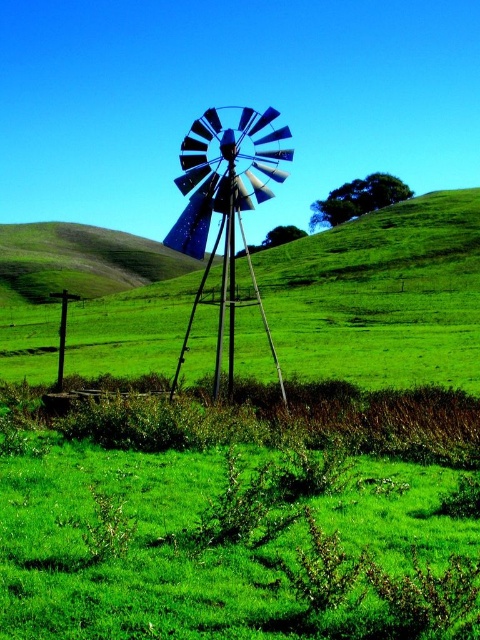
You are standing at the origin point in a rural landscape with a clear blue sky. You see a blue metallic windmill at center marked by point (x=223, y=216). If you walk straight ahead, will you reach the blue metallic windmill at center before the wooden post on the left?

The blue metallic windmill at center is represented by point (x=223, y=216), which indicates it is closer to the viewer than the wooden post on the left. Therefore, walking straight ahead, you will reach the blue metallic windmill at center before the wooden post on the left.

You are a landscape architect designing a new park and want to place a statue between the blue metallic windmill at center and the green grassy hillside at center. Based on their widths, which object should the statue be closer to?

The blue metallic windmill at center has a lesser width compared to the green grassy hillside at center, so the statue should be placed closer to the blue metallic windmill at center to maintain balance between the two objects.

You are a photographer planning to capture the metallic windmill at center and the green grassy hillside at center in a single shot. Based on their heights, which object will appear larger in the photo?

The metallic windmill at center is taller than the green grassy hillside at center, so it will appear larger in the photo.